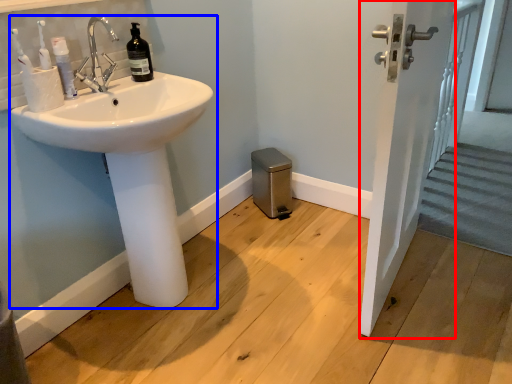
Question: Which object appears closest to the camera in this image, screen door (highlighted by a red box) or sink (highlighted by a blue box)?

Choices:
 (A) screen door
 (B) sink

Answer: (A)